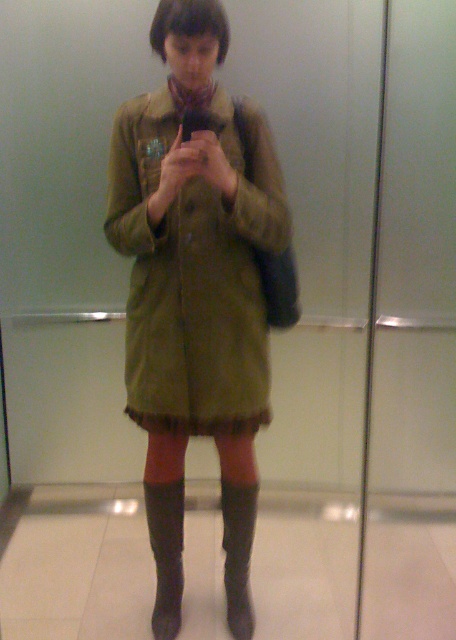
You are trying to take a selfie in front of a mirror and want to make sure your jacket is fully visible. Based on the scene, is the olive green fabric jacket at center positioned to the right or left of the leather at lower center?

The olive green fabric jacket at center is to the right of the leather at lower center, so positioning yourself slightly to the left might help ensure the jacket is fully visible in the mirror.